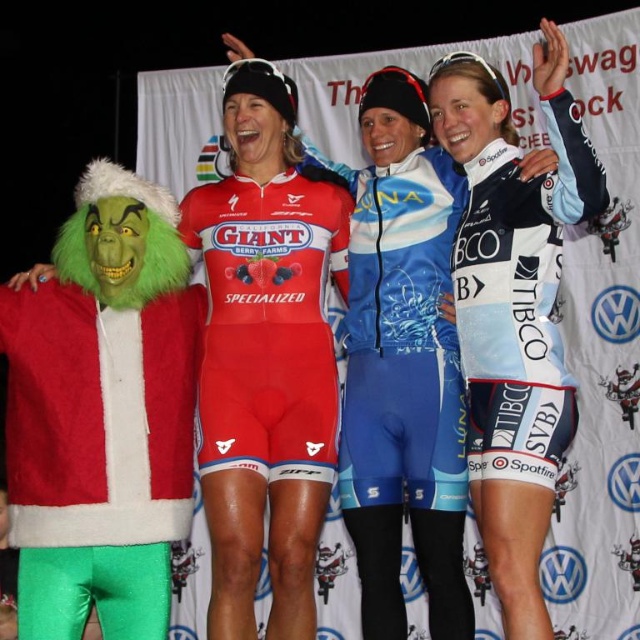
What is the purpose of the point at coordinates (404, 394)?

The point at coordinates (404, 394) marks the location of the blue and white jersey at center.